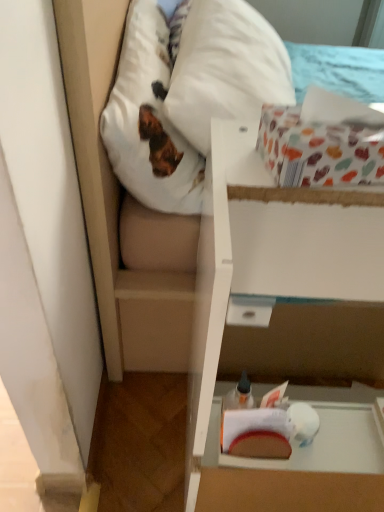
Question: From the image's perspective, relative to white soft pillow at upper left, is patterned paper box at upper right, the second cardboard box from the bottom, above or below?

Choices:
 (A) above
 (B) below

Answer: (B)

Question: Is point (329, 138) closer or farther from the camera than point (153, 83)?

Choices:
 (A) closer
 (B) farther

Answer: (A)

Question: Estimate the real-world distances between objects in this image. Which object is farther from the white fabric mattress at upper center?

Choices:
 (A) white cardboard box at center, which is the second cardboard box in top-to-bottom order
 (B) white soft pillow at upper left
 (C) patterned paper box at upper right, marked as the 1th cardboard box in a top-to-bottom arrangement

Answer: (C)

Question: Considering the real-world distances, which object is farthest from the white fabric mattress at upper center?

Choices:
 (A) white cardboard box at center, which is the second cardboard box in top-to-bottom order
 (B) patterned paper box at upper right, marked as the 1th cardboard box in a top-to-bottom arrangement
 (C) white soft pillow at upper left

Answer: (B)